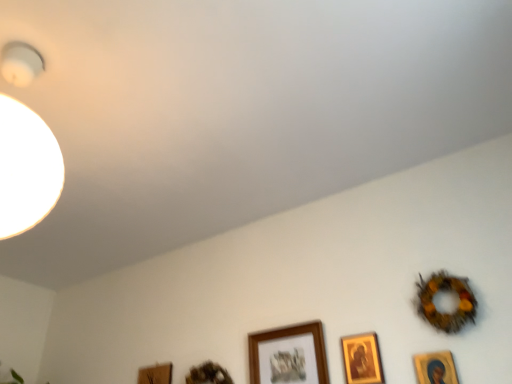
Question: From a real-world perspective, is wooden frame at lower center, the 1th picture frame in the left-to-right sequence, on top of wooden frame at lower center, acting as the third picture frame starting from the left?

Choices:
 (A) yes
 (B) no

Answer: (B)

Question: From the image's perspective, is wooden frame at lower center, which is the fifth picture frame from right to left, over wooden frame at lower center, arranged as the 3th picture frame when viewed from the right?

Choices:
 (A) no
 (B) yes

Answer: (A)

Question: Considering the relative sizes of wooden frame at lower center, the 1th picture frame in the left-to-right sequence, and wooden frame at lower center, arranged as the 3th picture frame when viewed from the right, in the image provided, is wooden frame at lower center, the 1th picture frame in the left-to-right sequence, thinner than wooden frame at lower center, arranged as the 3th picture frame when viewed from the right,?

Choices:
 (A) no
 (B) yes

Answer: (B)

Question: Is wooden frame at lower center, the 1th picture frame in the left-to-right sequence, shorter than wooden frame at lower center, arranged as the 3th picture frame when viewed from the right?

Choices:
 (A) yes
 (B) no

Answer: (A)

Question: Is wooden frame at lower center, the 1th picture frame in the left-to-right sequence, smaller than wooden frame at lower center, arranged as the 3th picture frame when viewed from the right?

Choices:
 (A) no
 (B) yes

Answer: (B)

Question: In the image, is gold-framed picture at lower right, which is counted as the 5th picture frame, starting from the left, on the left side or the right side of wooden frame at lower center, the 1th picture frame in the left-to-right sequence?

Choices:
 (A) left
 (B) right

Answer: (B)

Question: Would you say gold-framed picture at lower right, the 1th picture frame from the right, is inside or outside wooden frame at lower center, which is the fifth picture frame from right to left?

Choices:
 (A) inside
 (B) outside

Answer: (B)

Question: Relative to wooden frame at lower center, which is the fifth picture frame from right to left, is gold-framed picture at lower right, which is counted as the 5th picture frame, starting from the left, in front or behind?

Choices:
 (A) behind
 (B) front

Answer: (B)

Question: From the image's perspective, is gold-framed picture at lower right, which is counted as the 5th picture frame, starting from the left, positioned above or below wooden frame at lower center, which is the fifth picture frame from right to left?

Choices:
 (A) below
 (B) above

Answer: (B)

Question: Considering the positions of gold-framed picture at lower right, the 1th picture frame from the right, and wooden frame at lower center, arranged as the second picture frame when viewed from the left, in the image, is gold-framed picture at lower right, the 1th picture frame from the right, taller or shorter than wooden frame at lower center, arranged as the second picture frame when viewed from the left,?

Choices:
 (A) short
 (B) tall

Answer: (B)

Question: From a real-world perspective, is gold-framed picture at lower right, which is counted as the 5th picture frame, starting from the left, physically located above or below wooden frame at lower center, arranged as the second picture frame when viewed from the left?

Choices:
 (A) above
 (B) below

Answer: (B)

Question: In terms of size, does gold-framed picture at lower right, which is counted as the 5th picture frame, starting from the left, appear bigger or smaller than wooden frame at lower center, arranged as the second picture frame when viewed from the left?

Choices:
 (A) small
 (B) big

Answer: (A)

Question: Would you say gold-framed picture at lower right, which is counted as the 5th picture frame, starting from the left, is to the left or to the right of wooden frame at lower center, arranged as the second picture frame when viewed from the left, in the picture?

Choices:
 (A) left
 (B) right

Answer: (B)

Question: Looking at the image, does gold-framed picture at lower right, which is counted as the 5th picture frame, starting from the left, seem bigger or smaller compared to gold-framed picture at lower right, arranged as the second picture frame when viewed from the right?

Choices:
 (A) big
 (B) small

Answer: (B)

Question: Choose the correct answer: Is gold-framed picture at lower right, the 1th picture frame from the right, inside gold-framed picture at lower right, arranged as the second picture frame when viewed from the right, or outside it?

Choices:
 (A) inside
 (B) outside

Answer: (B)